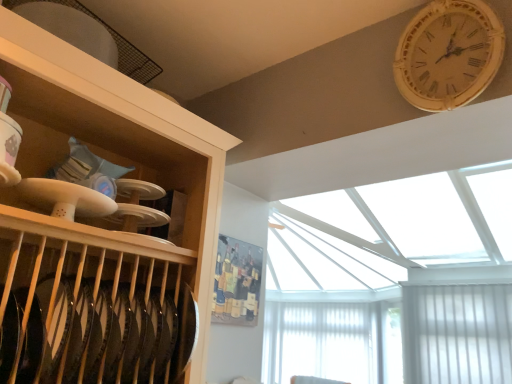
Question: Choose the correct answer: Is white wooden clock at upper right inside white sheer curtain at lower right or outside it?

Choices:
 (A) inside
 (B) outside

Answer: (B)

Question: Is white wooden clock at upper right taller or shorter than white sheer curtain at lower right?

Choices:
 (A) tall
 (B) short

Answer: (B)

Question: From a real-world perspective, is white wooden clock at upper right positioned above or below white sheer curtain at lower right?

Choices:
 (A) above
 (B) below

Answer: (A)

Question: In the image, is white sheer curtain at lower right positioned in front of or behind white wooden clock at upper right?

Choices:
 (A) behind
 (B) front

Answer: (A)

Question: From a real-world perspective, relative to white wooden clock at upper right, is white sheer curtain at lower right vertically above or below?

Choices:
 (A) above
 (B) below

Answer: (B)

Question: In terms of height, does white sheer curtain at lower right look taller or shorter compared to white wooden clock at upper right?

Choices:
 (A) tall
 (B) short

Answer: (A)

Question: From the image's perspective, is white sheer curtain at lower right located above or below white wooden clock at upper right?

Choices:
 (A) below
 (B) above

Answer: (A)